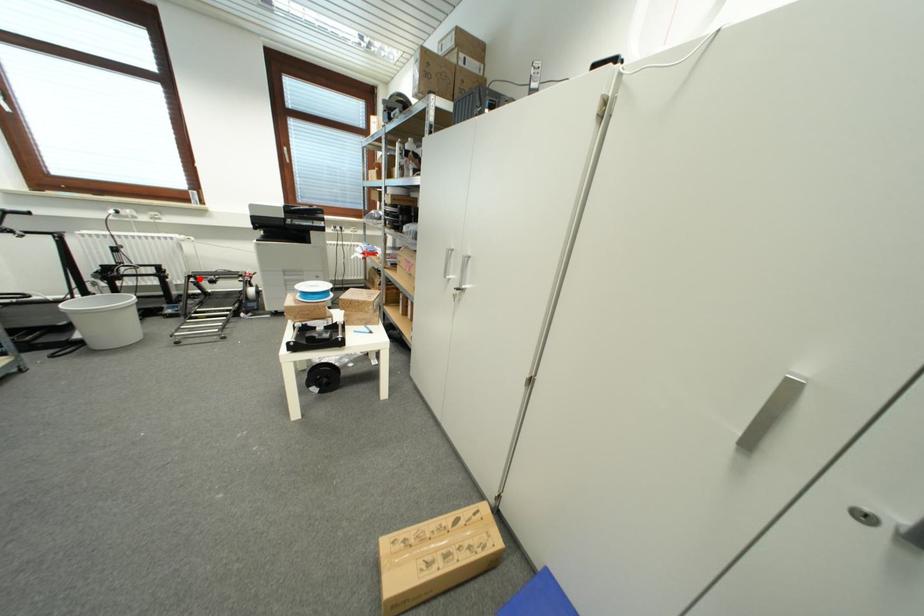
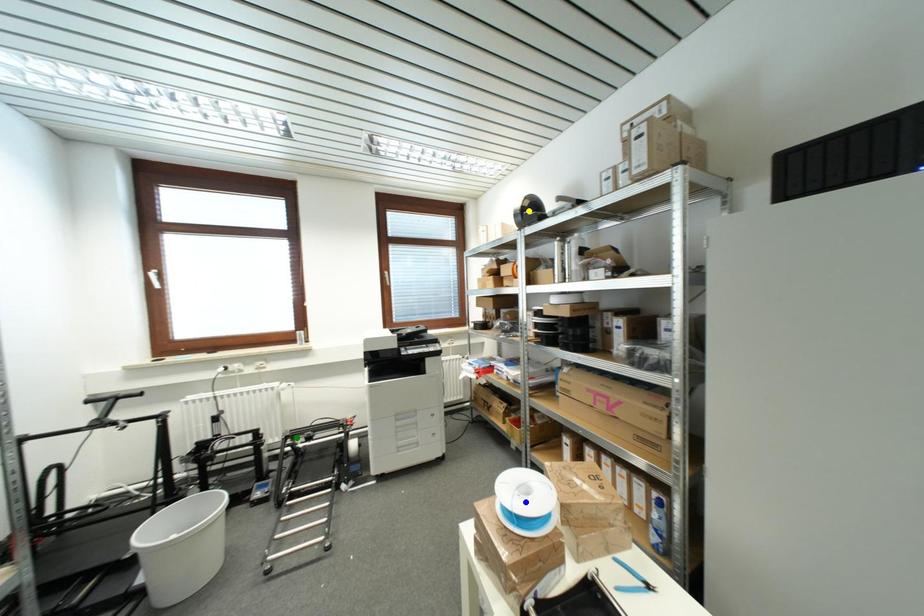
Question: I am providing you with two images of the same scene from different viewpoints. A red point is marked on the first image. You are given multiple points on the second image. In image 2, which mark is for the same physical point as the one in image 1?

Choices:
 (A) green point
 (B) yellow point
 (C) blue point

Answer: (A)